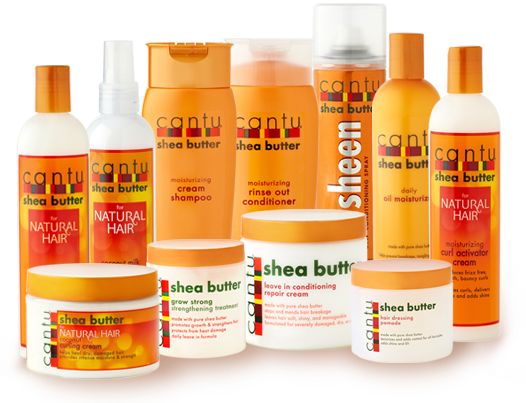
The image size is (526, 403). What are the coordinates of `bottles` in the screenshot? It's located at (50, 205), (117, 183), (190, 154), (281, 140), (347, 121), (413, 121), (467, 161).